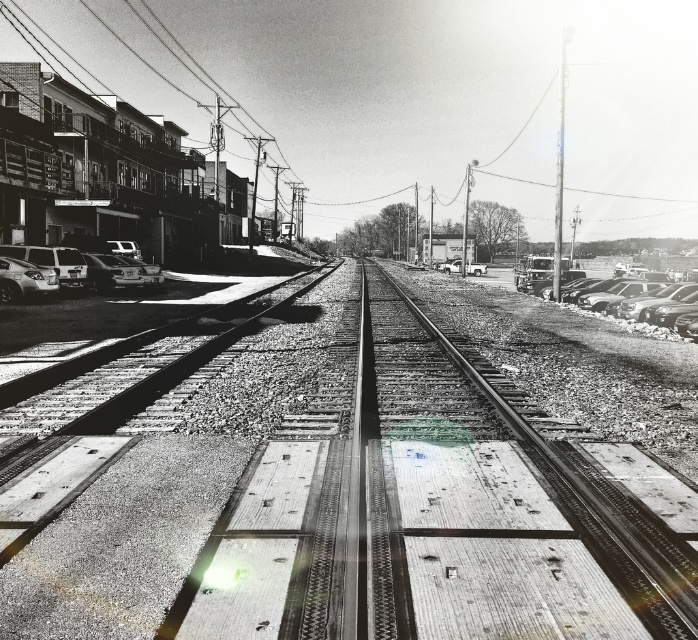
You are a pedestrian standing at the shiny silver sedan at left and want to cross to the smooth concrete train track at center. Which direction should you walk to reach the track?

The smooth concrete train track at center is positioned on the right side of the shiny silver sedan at left. Therefore, you should walk to your right to reach the track.

You are a pedestrian standing at the railway crossing and want to cross to the other side. There are two cars, a shiny silver sedan at lower left and a metallic silver car at center. Which car is closer to you?

The shiny silver sedan at lower left is closer to the viewer than the metallic silver car at center.